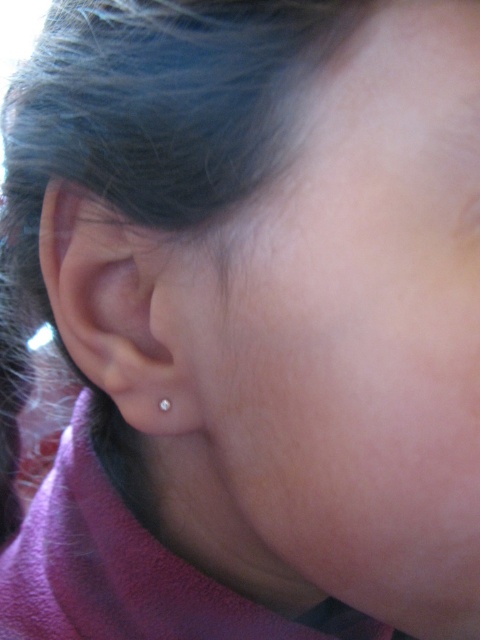
Does clear gold earring at left have a greater width compared to pearl-like earring at ear?

Indeed, clear gold earring at left has a greater width compared to pearl-like earring at ear.

Is clear gold earring at left closer to the viewer compared to pearl-like earring at ear?

Yes.

Who is more distant from viewer, (116,282) or (159,401)?

The point (116,282) is behind.

You are a GUI agent. You are given a task and a screenshot of the screen. Output one action in this format:
    pyautogui.click(x=<x>, y=<y>)
    Task: Click on the clear gold earring at left
    This screenshot has height=640, width=480.
    Given the screenshot: What is the action you would take?
    pyautogui.click(x=118, y=308)